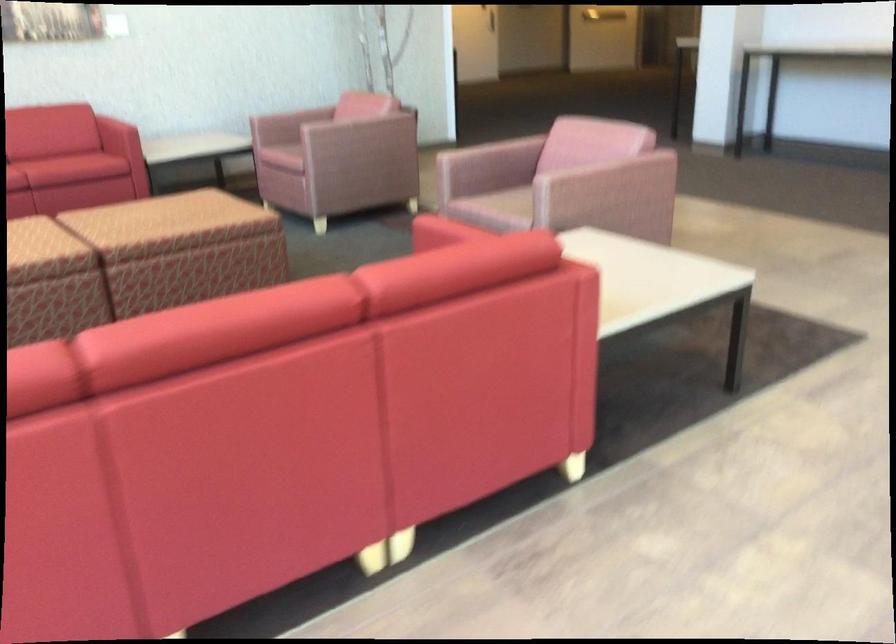
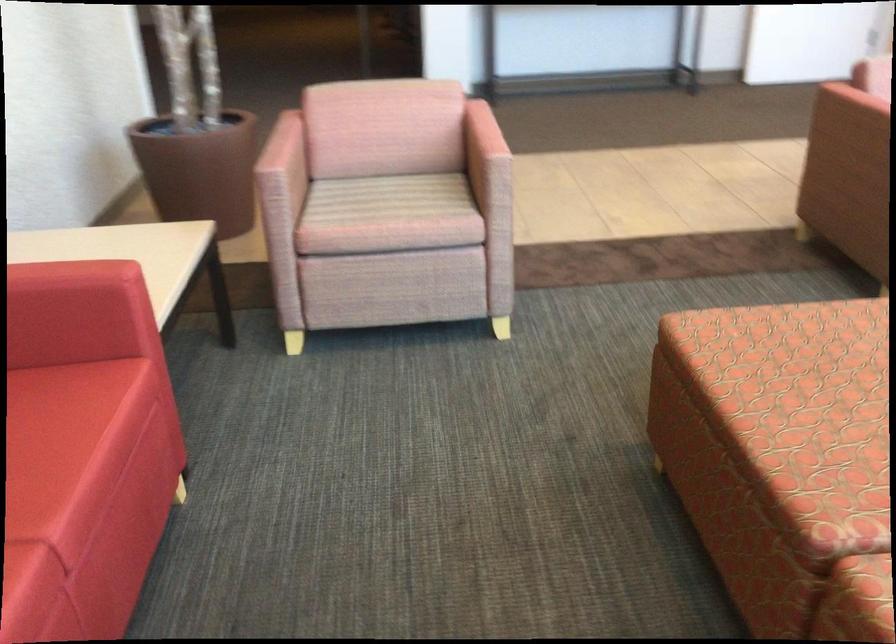
Where in the second image is the point corresponding to point 89,134 from the first image?

(38, 408)